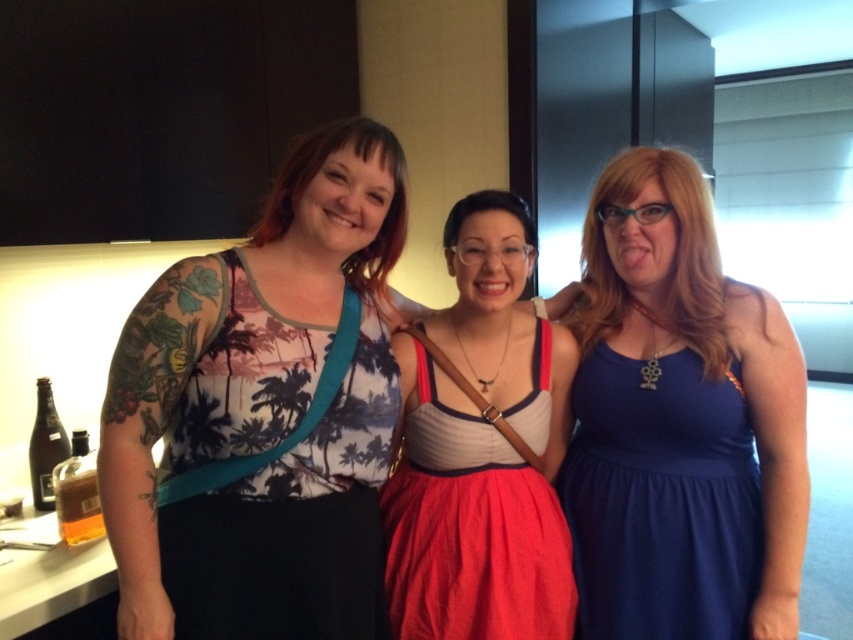
What is located at the coordinates point (263,412)?

The printed fabric top at center is located at point (263,412).

You are taking a photo of two points in the scene. The first point is at coordinate point (x=329, y=609) and the second point is at coordinate point (x=549, y=550). Which point is closer to the camera?

Point (x=329, y=609) is closer to the camera than point (x=549, y=550).

You are standing in the kitchen and see the printed fabric top at center. Where exactly is it positioned in terms of coordinates?

The printed fabric top at center is located at point (263, 412).